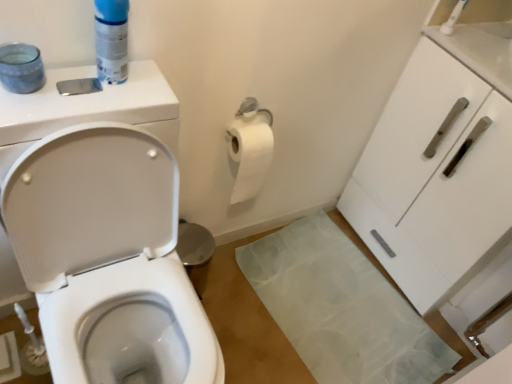
Question: From their relative heights in the image, would you say white glossy cabinet at right is taller or shorter than white glossy toilet at left?

Choices:
 (A) tall
 (B) short

Answer: (B)

Question: Considering the relative positions of white glossy cabinet at right and white glossy toilet at left in the image provided, is white glossy cabinet at right to the left or to the right of white glossy toilet at left?

Choices:
 (A) left
 (B) right

Answer: (B)

Question: Estimate the real-world distances between objects in this image. Which object is farther from the white glossy toilet at left?

Choices:
 (A) white glossy cabinet at right
 (B) blue plastic can at upper left

Answer: (A)

Question: Which is nearer to the blue plastic can at upper left?

Choices:
 (A) white glossy toilet at left
 (B) white glossy cabinet at right

Answer: (A)